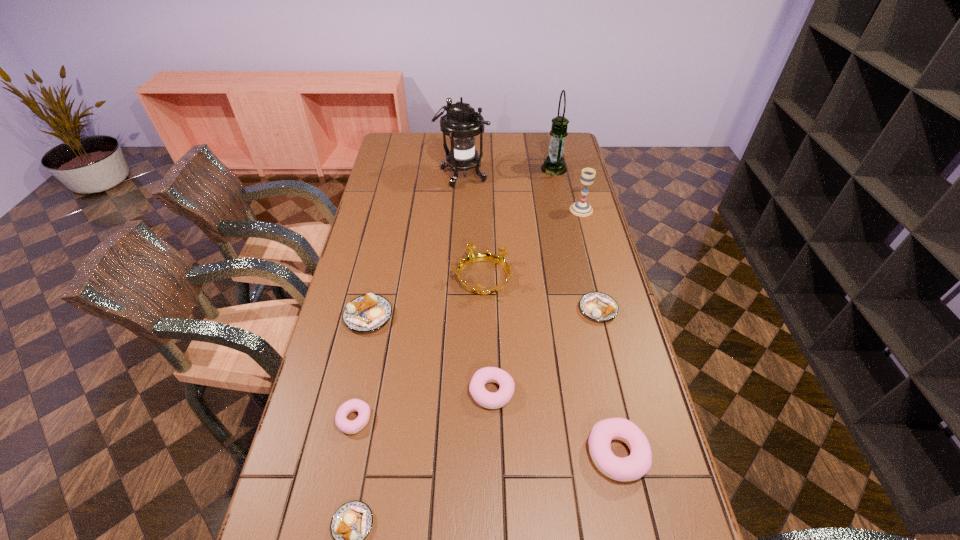
The image size is (960, 540). Find the location of `vacant space in between the third farthest object and the second smallest brown pastry`. vacant space in between the third farthest object and the second smallest brown pastry is located at coordinates (589, 259).

Where is `unoccupied position between the rightmost pink pastry and the fourth pastry from left to right`? This screenshot has height=540, width=960. unoccupied position between the rightmost pink pastry and the fourth pastry from left to right is located at coordinates (554, 422).

What are the coordinates of `vacant area between the fourth tallest object and the rightmost pink pastry` in the screenshot? It's located at (550, 366).

This screenshot has height=540, width=960. I want to click on empty space that is in between the right lantern and the biggest brown pastry, so click(x=461, y=242).

Find the location of a particular element. The height and width of the screenshot is (540, 960). vacant space in between the fourth pastry from left to right and the green lantern is located at coordinates (523, 280).

The width and height of the screenshot is (960, 540). In order to click on empty location between the fourth tallest object and the biggest pink pastry in this screenshot , I will do `click(550, 366)`.

At what (x,y) coordinates should I click in order to perform the action: click on free point between the rightmost brown pastry and the crown. Please return your answer as a coordinate pair (x, y). Looking at the image, I should click on (540, 294).

I want to click on object that ranks as the ninth closest to the green lantern, so click(351, 523).

At what (x,y) coordinates should I click in order to perform the action: click on the fifth closest object to the rightmost pink pastry. Please return your answer as a coordinate pair (x, y). Looking at the image, I should click on (349, 427).

Select which pastry appears as the second closest to the chalice. Please provide its 2D coordinates. Your answer should be formatted as a tuple, i.e. [(x, y)], where the tuple contains the x and y coordinates of a point satisfying the conditions above.

[(486, 399)]